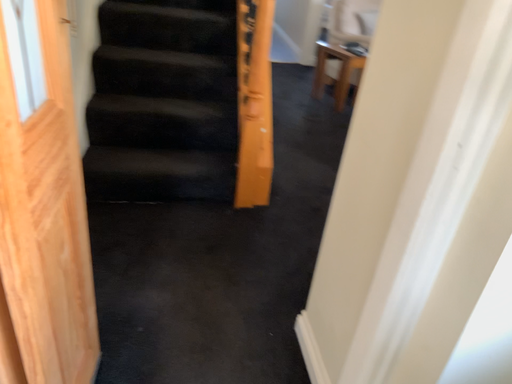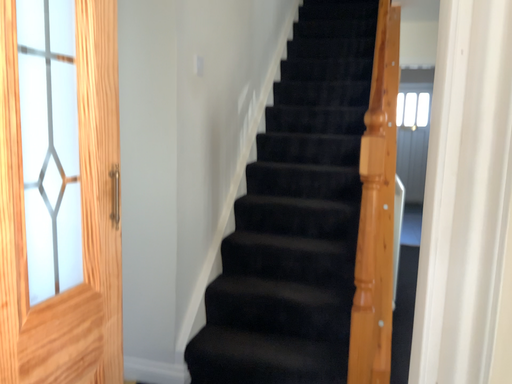
Question: Which way did the camera rotate in the video?

Choices:
 (A) rotated upward
 (B) rotated downward

Answer: (A)